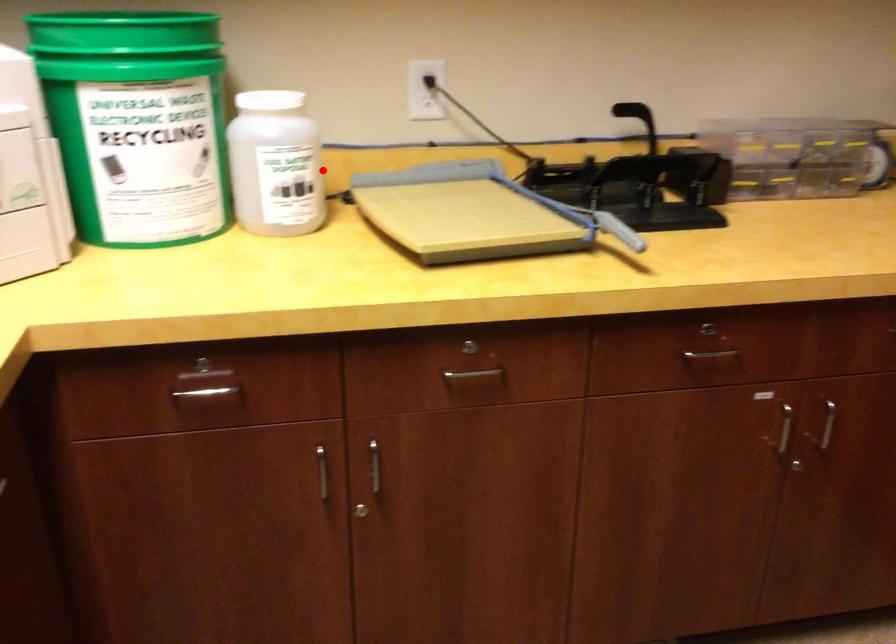
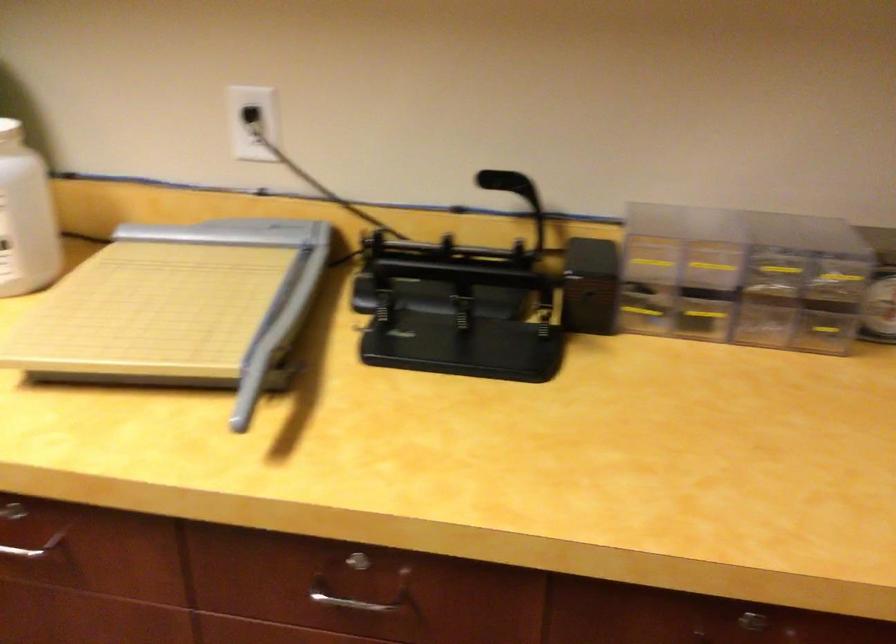
Locate, in the second image, the point that corresponds to the highlighted location in the first image.

(26, 218)